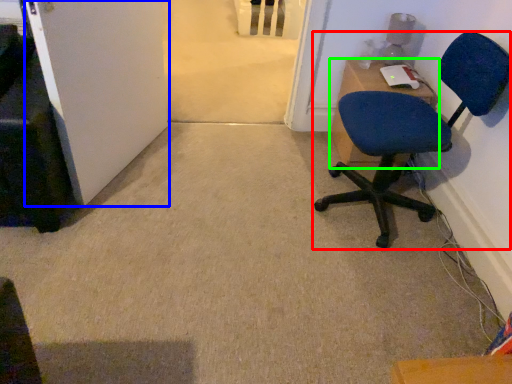
Question: Which object is positioned farthest from chair (highlighted by a red box)? Select from door (highlighted by a blue box) and desk (highlighted by a green box).

Choices:
 (A) door
 (B) desk

Answer: (A)